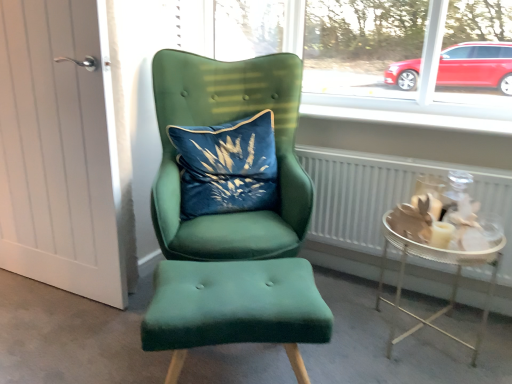
At what (x,y) coordinates should I click in order to perform the action: click on blank space situated above white textured radiator at lower right (from a real-world perspective). Please return your answer as a coordinate pair (x, y). Looking at the image, I should click on (412, 146).